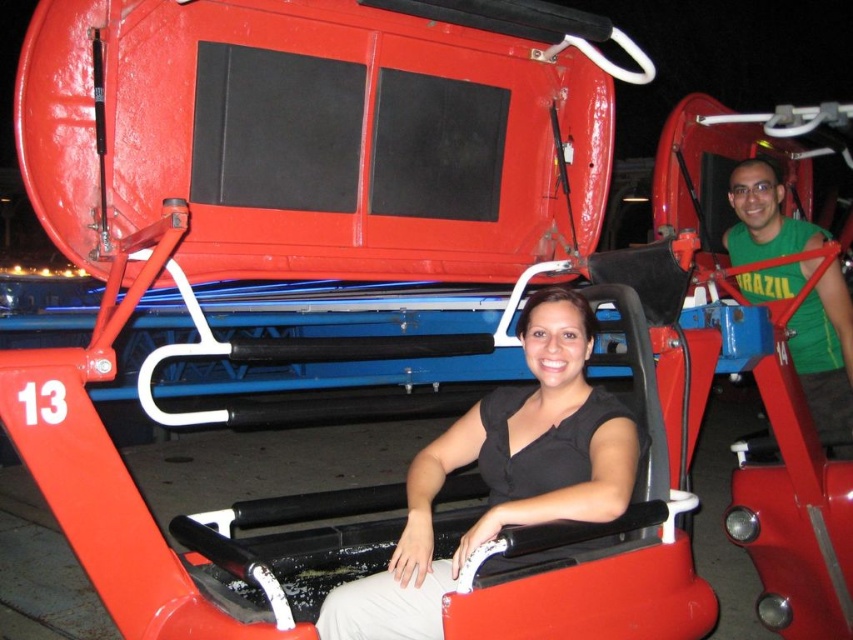
You are a photographer standing at the front of the amusement park ride. You want to take a photo that includes both the black matte shirt at center and the green fabric shirt at right. The minimum distance between the shirts required for your camera to focus on both is 6 feet. Will you be able to capture both shirts in focus?

The black matte shirt at center is 5.50 feet from the green fabric shirt at right, which is less than the 6 feet required for the camera to focus on both. Therefore, you will not be able to capture both shirts in focus.

You are a photographer at the amusement park and want to capture both the black matte shirt at center and the green fabric shirt at right in a single frame. Which shirt should you focus on to ensure both are visible without zooming in or out?

The black matte shirt at center is smaller than the green fabric shirt at right, so focusing on the green fabric shirt at right would allow both shirts to be visible in the frame without needing to adjust the zoom.